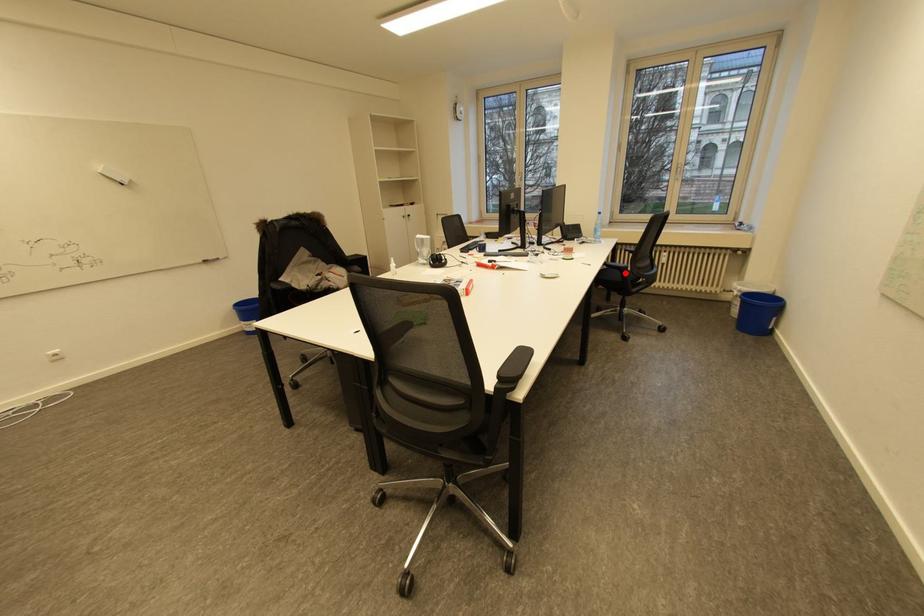
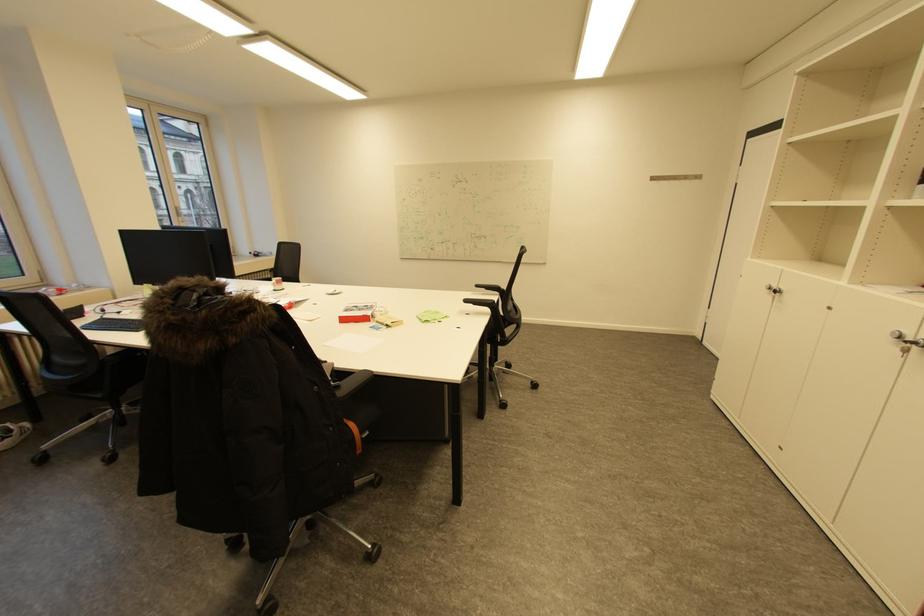
Question: I am providing you with two images of the same scene from different viewpoints. A red point is marked on the first image. Can you still see the location of the red point in image 2?

Choices:
 (A) Yes
 (B) No

Answer: (B)